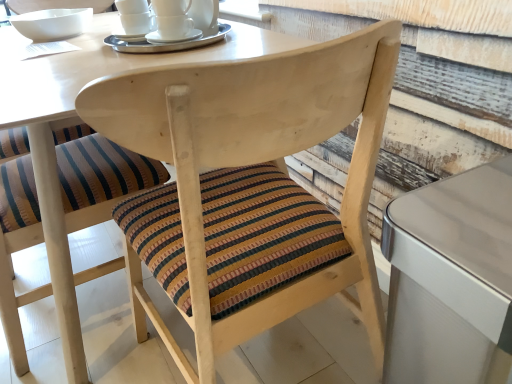
Where is `vacant space situated on the left part of white ceramic cups at upper center`? vacant space situated on the left part of white ceramic cups at upper center is located at coordinates (69, 54).